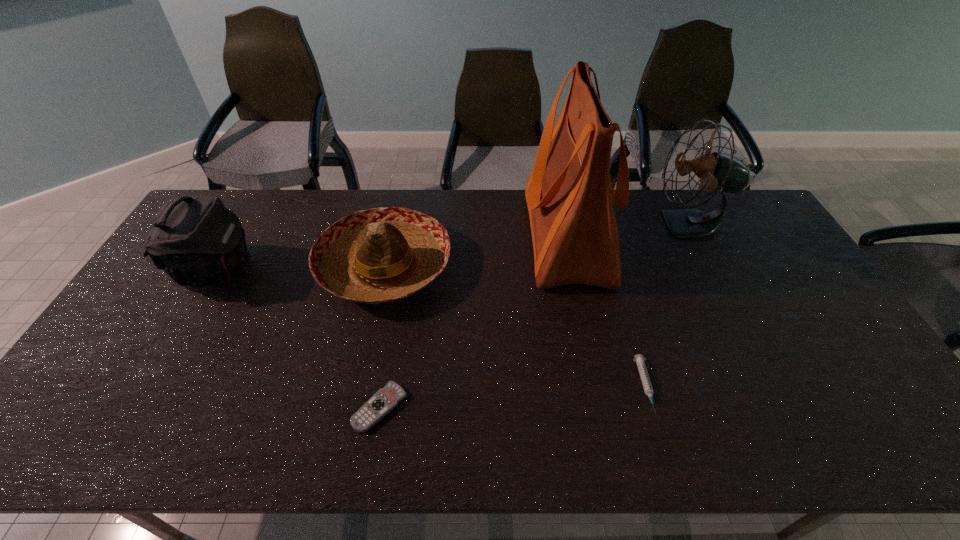
At what (x,y) coordinates should I click in order to perform the action: click on shopping bag. Please return your answer as a coordinate pair (x, y). The height and width of the screenshot is (540, 960). Looking at the image, I should click on (569, 194).

At what (x,y) coordinates should I click in order to perform the action: click on fan. Please return your answer as a coordinate pair (x, y). This screenshot has width=960, height=540. Looking at the image, I should click on (717, 171).

Find the location of a particular element. the rightmost object is located at coordinates (717, 171).

Find the location of `the leftmost object`. the leftmost object is located at coordinates (196, 240).

Where is `the fourth shortest object`? the fourth shortest object is located at coordinates (x=196, y=240).

Locate an element on the screen. the third shortest object is located at coordinates (379, 255).

Identify the location of syringe. The height and width of the screenshot is (540, 960). (639, 359).

Locate an element on the screen. The width and height of the screenshot is (960, 540). remote control is located at coordinates (385, 399).

The height and width of the screenshot is (540, 960). What are the coordinates of `vacant space located 0.340m on the front pocket of the tallest object` in the screenshot? It's located at (422, 236).

Where is `vacant region located on the front pocket of the tallest object`? The width and height of the screenshot is (960, 540). vacant region located on the front pocket of the tallest object is located at coordinates (446, 236).